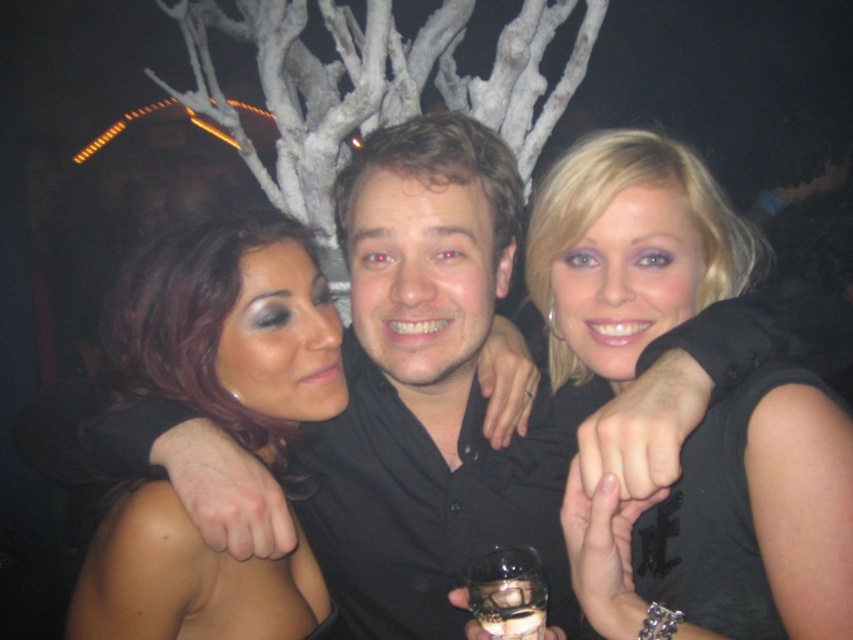
Question: Can you confirm if black matte dress at center is positioned to the right of shiny dark hair at center?

Choices:
 (A) yes
 (B) no

Answer: (A)

Question: Which point is farther to the camera?

Choices:
 (A) (795, 406)
 (B) (233, 221)

Answer: (B)

Question: Does black matte dress at center appear on the right side of shiny dark hair at center?

Choices:
 (A) yes
 (B) no

Answer: (A)

Question: Is black matte dress at center to the left of shiny dark hair at center from the viewer's perspective?

Choices:
 (A) no
 (B) yes

Answer: (A)

Question: Which point is farther from the camera taking this photo?

Choices:
 (A) (142, 332)
 (B) (622, 182)

Answer: (A)